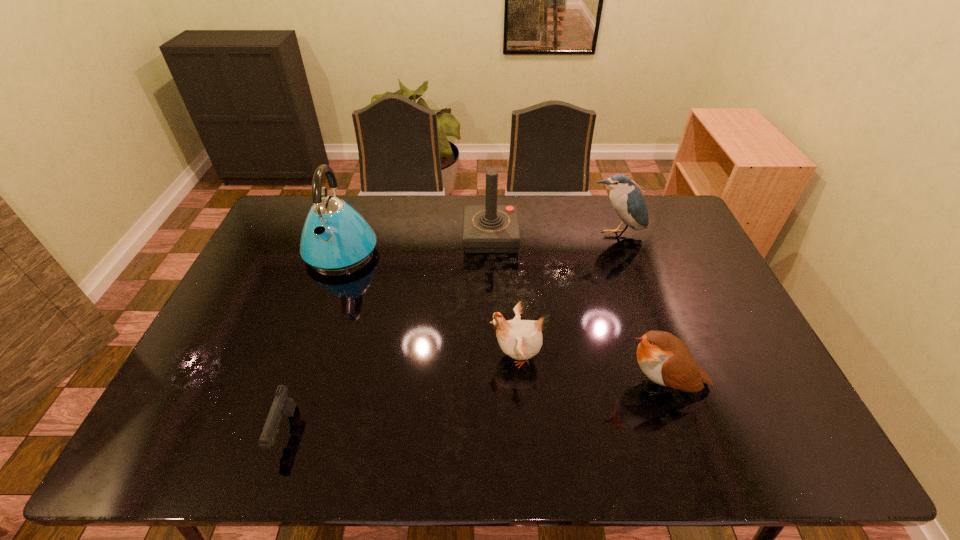
Identify the location of vacant point located between the pistol and the leftmost bird. (400, 393).

Find the location of a particular element. The height and width of the screenshot is (540, 960). free space between the tallest object and the pistol is located at coordinates (313, 341).

This screenshot has width=960, height=540. I want to click on free spot between the pistol and the joystick, so click(x=388, y=334).

Identify the location of free spot between the joystick and the leftmost bird. Image resolution: width=960 pixels, height=540 pixels. coord(504,296).

Find the location of a particular element. Image resolution: width=960 pixels, height=540 pixels. empty location between the leftmost bird and the joystick is located at coordinates (504, 296).

Identify which object is located as the nearest to the kettle. Please provide its 2D coordinates. Your answer should be formatted as a tuple, i.e. [(x, y)], where the tuple contains the x and y coordinates of a point satisfying the conditions above.

[(490, 228)]

The image size is (960, 540). I want to click on object that is the fifth nearest to the joystick, so click(282, 404).

This screenshot has height=540, width=960. In order to click on bird that is the closest one to the leftmost bird in this screenshot , I will do `click(666, 360)`.

Where is `bird that is the second closest to the tallest object`? bird that is the second closest to the tallest object is located at coordinates (627, 200).

Identify the location of free location that satisfies the following two spatial constraints: 1. at the tip of the tallest bird's beak; 2. at the beak of the leftmost bird. The image size is (960, 540). (657, 355).